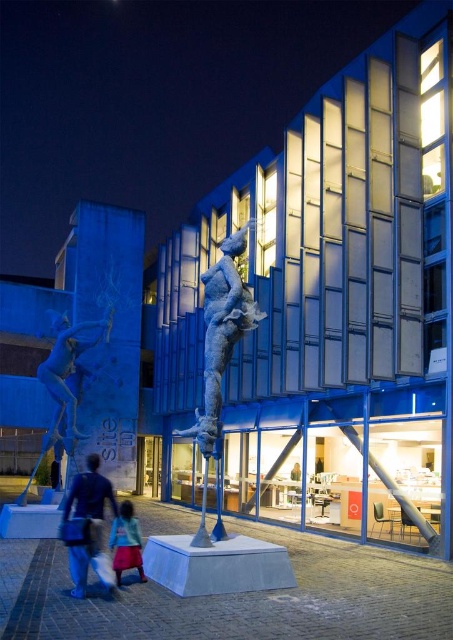
Does point (99, 458) lie in front of point (134, 560)?

That is False.

Between point (90, 554) and point (117, 556), which one is positioned behind?

Positioned behind is point (117, 556).

Locate an element on the screen. This screenshot has width=453, height=640. blue fabric bag at lower left is located at coordinates pyautogui.click(x=86, y=525).

Is point (247, 292) in front of point (106, 586)?

No, (247, 292) is behind (106, 586).

Where is `blue metallic statue at center`? This screenshot has width=453, height=640. blue metallic statue at center is located at coordinates (221, 333).

You are a GUI agent. You are given a task and a screenshot of the screen. Output one action in this format:
    pyautogui.click(x=<x>, y=<y>)
    Task: Click on the blue metallic statue at center
    
    Given the screenshot: What is the action you would take?
    pyautogui.click(x=221, y=333)

Who is lower down, blue metallic statue at left or blue fabric bag at lower left?

blue fabric bag at lower left

Is blue metallic statue at left below blue fabric bag at lower left?

Actually, blue metallic statue at left is above blue fabric bag at lower left.

This screenshot has width=453, height=640. Find the location of `blue metallic statue at left`. blue metallic statue at left is located at coordinates (67, 372).

This screenshot has width=453, height=640. I want to click on blue metallic statue at left, so click(x=67, y=372).